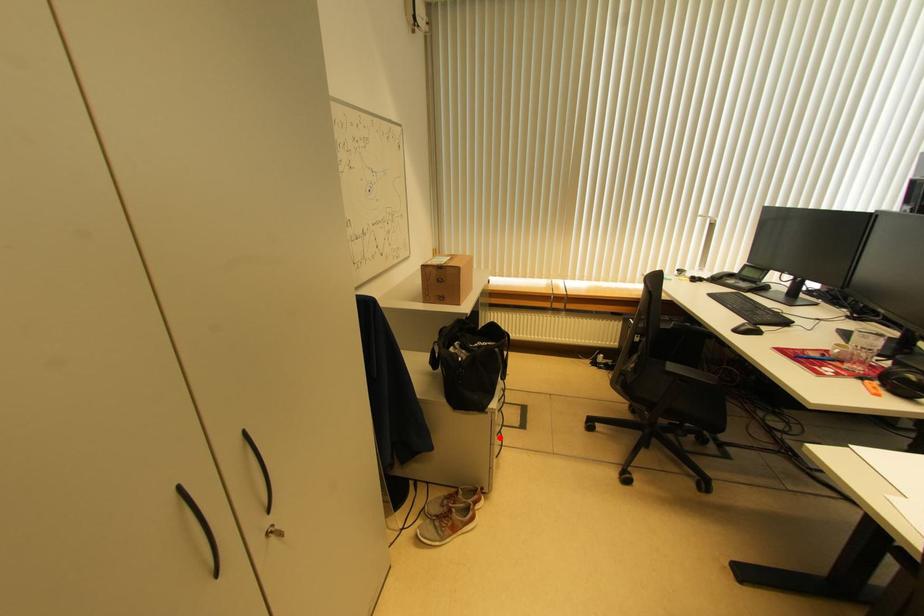
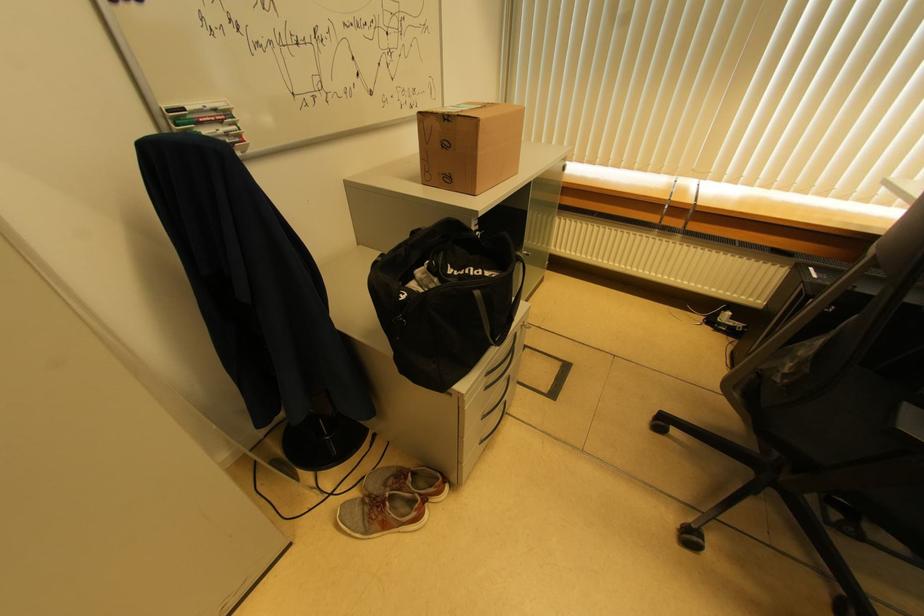
Find the pixel in the second image that matches the highlighted location in the first image.

(485, 419)